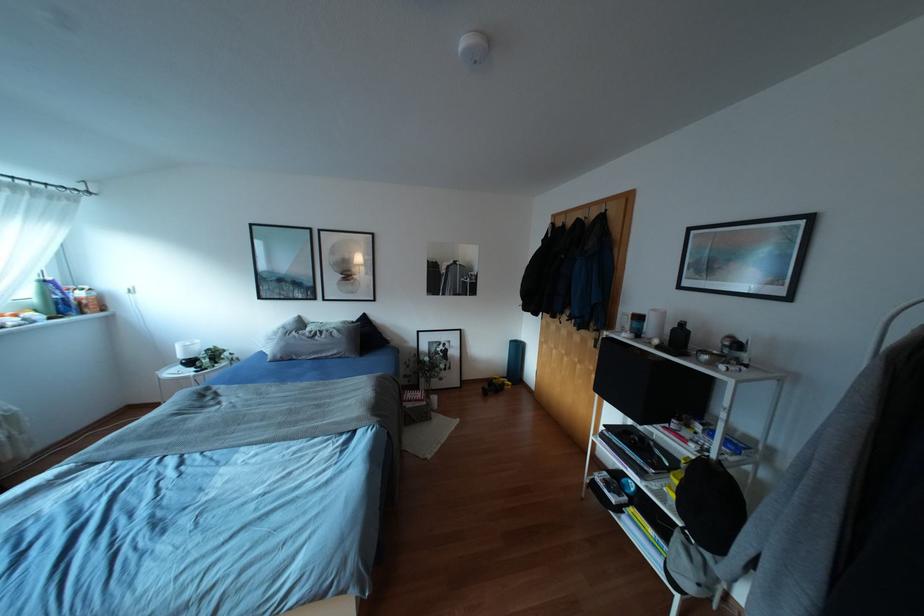
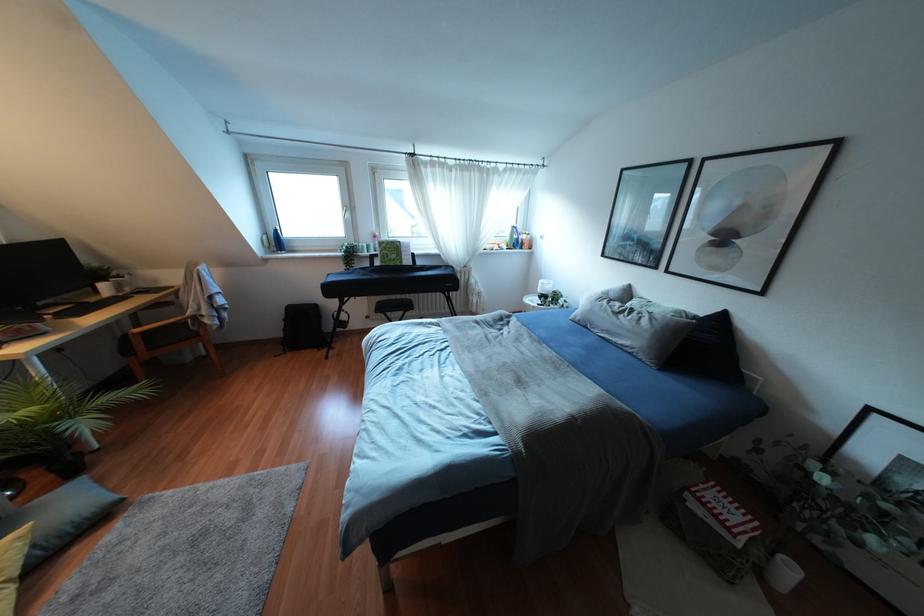
The point at (433, 398) is marked in the first image. Where is the corresponding point in the second image?

(791, 570)